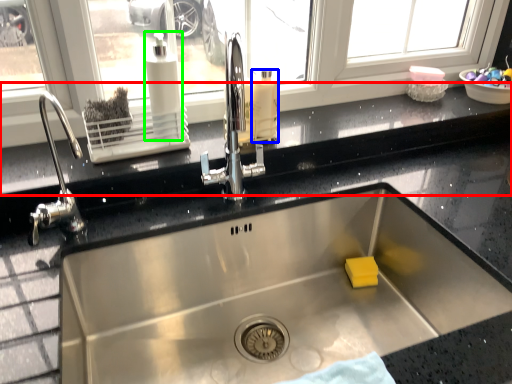
Question: Considering the real-world distances, which object is closest to window sill (highlighted by a red box)? cleaning product (highlighted by a blue box) or soap dispenser (highlighted by a green box).

Choices:
 (A) cleaning product
 (B) soap dispenser

Answer: (A)